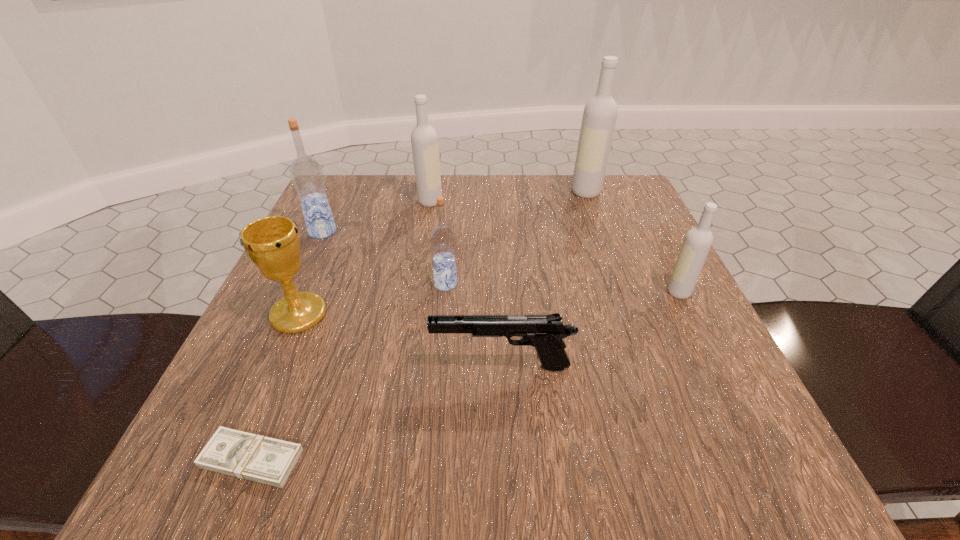
Identify the location of the tallest vodka. (600, 113).

Locate an element on the screen. the biggest white vodka is located at coordinates (600, 113).

Locate an element on the screen. The image size is (960, 540). the second smallest white vodka is located at coordinates click(x=424, y=140).

Find the location of `the leftmost white vodka`. the leftmost white vodka is located at coordinates (424, 140).

You are a GUI agent. You are given a task and a screenshot of the screen. Output one action in this format:
    pyautogui.click(x=<x>, y=<y>)
    Task: Click on the leftmost vodka
    The width and height of the screenshot is (960, 540).
    Given the screenshot: What is the action you would take?
    pyautogui.click(x=306, y=173)

You are a GUI agent. You are given a task and a screenshot of the screen. Output one action in this format:
    pyautogui.click(x=<x>, y=<y>)
    Task: Click on the third nearest vodka
    
    Given the screenshot: What is the action you would take?
    pyautogui.click(x=306, y=173)

Where is `the rightmost object`? the rightmost object is located at coordinates (697, 242).

At what (x,y) coordinates should I click in order to perform the action: click on the rightmost white vodka. Please return your answer as a coordinate pair (x, y). The image size is (960, 540). Looking at the image, I should click on (697, 242).

Identify the location of the third vodka from left to right. (442, 237).

What are the coordinates of `the smaller blue vodka` in the screenshot? It's located at (442, 237).